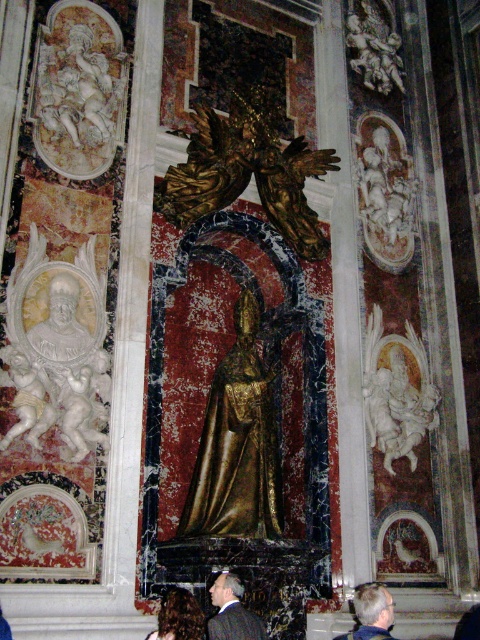
Question: Can you confirm if gold polished statue at center is wider than white marble statue at right?

Choices:
 (A) no
 (B) yes

Answer: (B)

Question: Where is gold polished statue at center located in relation to dark suit at center in the image?

Choices:
 (A) right
 (B) left

Answer: (A)

Question: Which object appears closest to the camera in this image?

Choices:
 (A) dark suit at center
 (B) gold polished statue at center
 (C) light brown hair at center
 (D) white marble statue at right

Answer: (C)

Question: Which point appears farthest from the camera in this image?

Choices:
 (A) (357, 600)
 (B) (410, 404)
 (C) (217, 624)

Answer: (B)

Question: Can you confirm if white marble statue at right is bigger than light brown hair at center?

Choices:
 (A) no
 (B) yes

Answer: (A)

Question: Which point is farther to the camera?

Choices:
 (A) dark suit at center
 (B) light brown hair at center
 (C) gold polished statue at center

Answer: (C)